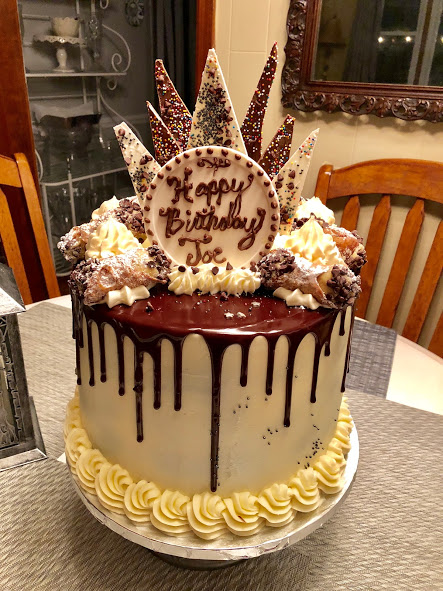
In order to click on brown wooden places to sit in this screenshot , I will do `click(407, 178)`, `click(5, 172)`.